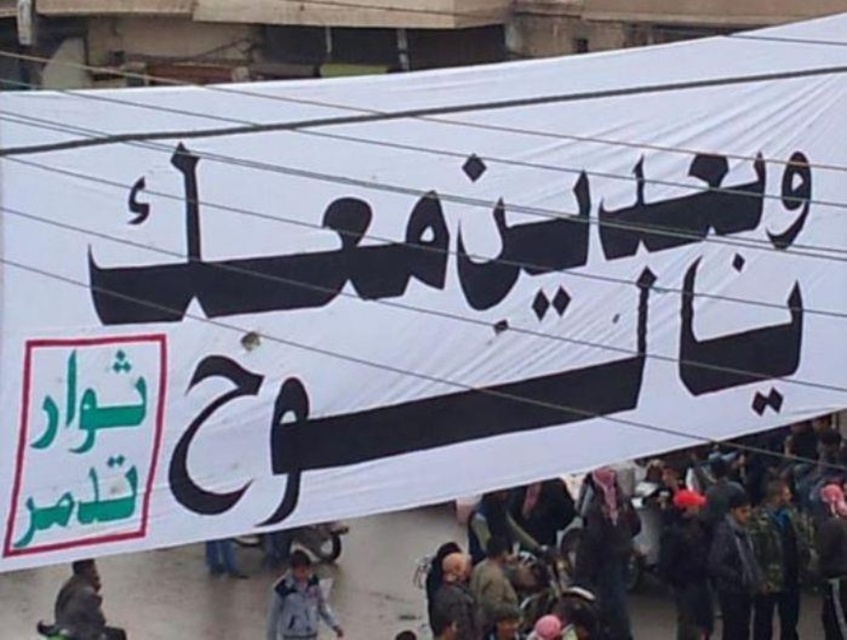
Between dark gray clothing at lower right and brown leather jacket at lower left, which one is positioned lower?

Positioned lower is brown leather jacket at lower left.

Measure the distance between dark gray clothing at lower right and camera.

A distance of 34.43 meters exists between dark gray clothing at lower right and camera.

Where is `dark gray clothing at lower right`? Image resolution: width=847 pixels, height=640 pixels. dark gray clothing at lower right is located at coordinates (726, 509).

From the picture: Does dark gray clothing at lower right have a larger size compared to white fleece jacket at center?

No, dark gray clothing at lower right is not bigger than white fleece jacket at center.

In the scene shown: Does dark gray clothing at lower right have a greater height compared to white fleece jacket at center?

In fact, dark gray clothing at lower right may be shorter than white fleece jacket at center.

In order to click on dark gray clothing at lower right in this screenshot , I will do `click(726, 509)`.

Is point (316, 621) in front of point (125, 636)?

No.

Based on the photo, which is above, white fleece jacket at center or brown leather jacket at lower left?

white fleece jacket at center is above.

Is point (306, 612) less distant than point (70, 628)?

No, (306, 612) is behind (70, 628).

Locate an element on the screen. The width and height of the screenshot is (847, 640). white fleece jacket at center is located at coordinates (297, 602).